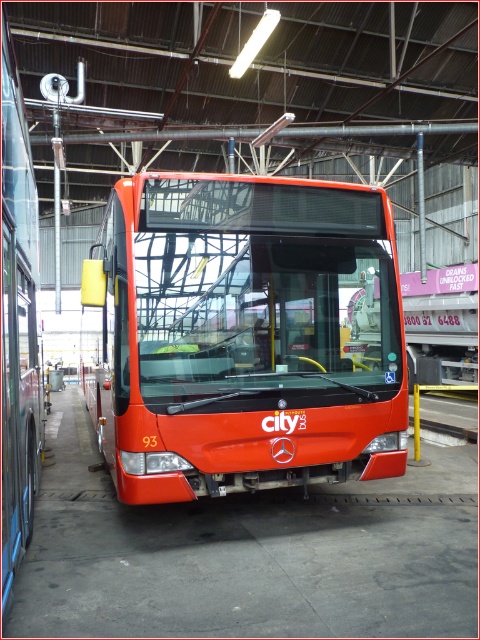
Question: Does shiny red bus at center appear on the left side of shiny orange bus at center?

Choices:
 (A) yes
 (B) no

Answer: (B)

Question: Which of the following is the closest to the observer?

Choices:
 (A) (159, 433)
 (B) (3, 195)

Answer: (B)

Question: Is shiny red bus at center wider than shiny orange bus at center?

Choices:
 (A) no
 (B) yes

Answer: (B)

Question: Which of the following is the closest to the observer?

Choices:
 (A) (26, 440)
 (B) (314, 257)

Answer: (A)

Question: Does shiny red bus at center appear under shiny orange bus at center?

Choices:
 (A) no
 (B) yes

Answer: (B)

Question: Which object appears farthest from the camera in this image?

Choices:
 (A) shiny red bus at center
 (B) shiny orange bus at center

Answer: (A)